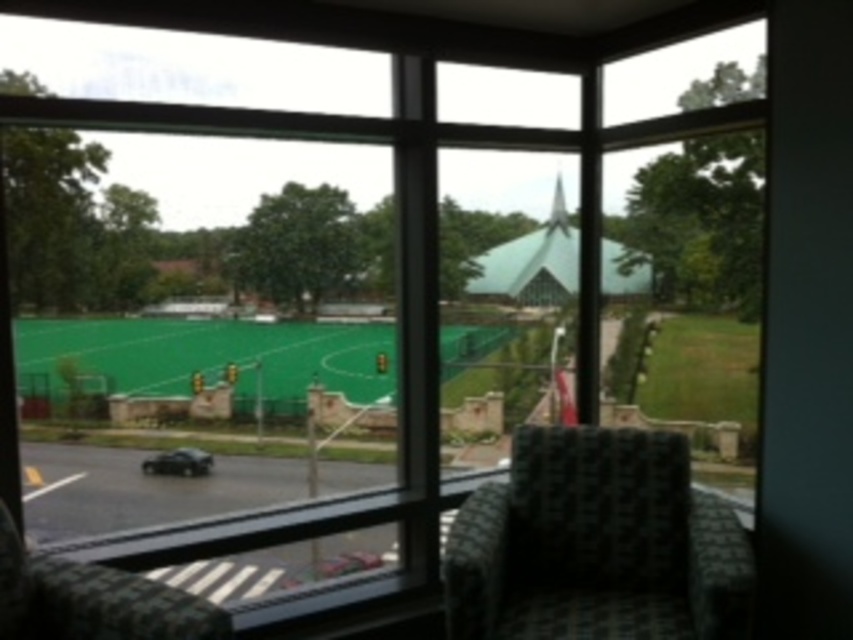
Which of these two, green artificial turf at center or shiny black car at lower left, stands shorter?

shiny black car at lower left is shorter.

Consider the image. Is green artificial turf at center positioned behind shiny black car at lower left?

No, green artificial turf at center is in front of shiny black car at lower left.

The width and height of the screenshot is (853, 640). What do you see at coordinates (204, 355) in the screenshot?
I see `green artificial turf at center` at bounding box center [204, 355].

Identify the location of green artificial turf at center. The width and height of the screenshot is (853, 640). (204, 355).

The image size is (853, 640). Describe the element at coordinates (596, 545) in the screenshot. I see `dark green woven armchair at lower right` at that location.

This screenshot has height=640, width=853. What are the coordinates of `dark green woven armchair at lower right` in the screenshot? It's located at (596, 545).

Between point (665, 481) and point (367, 388), which one is positioned behind?

The point (367, 388) is behind.

You are a GUI agent. You are given a task and a screenshot of the screen. Output one action in this format:
    pyautogui.click(x=<x>, y=<y>)
    Task: Click on the dark green woven armchair at lower right
    Image resolution: width=853 pixels, height=640 pixels.
    Given the screenshot: What is the action you would take?
    pyautogui.click(x=596, y=545)

Does dark green woven armchair at lower right have a lesser height compared to shiny black car at lower left?

No.

Is dark green woven armchair at lower right further to camera compared to shiny black car at lower left?

That is False.

Identify the location of dark green woven armchair at lower right. The width and height of the screenshot is (853, 640). (596, 545).